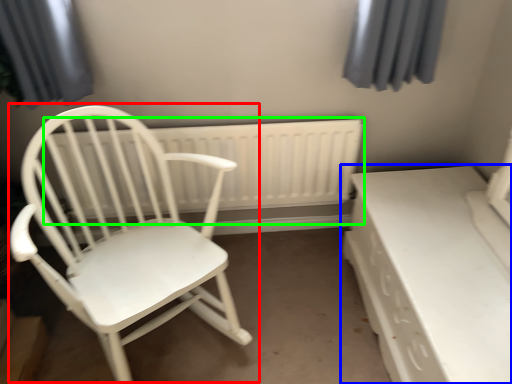
Question: Which is nearer to the chair (highlighted by a red box)? table (highlighted by a blue box) or radiator (highlighted by a green box).

Choices:
 (A) table
 (B) radiator

Answer: (B)